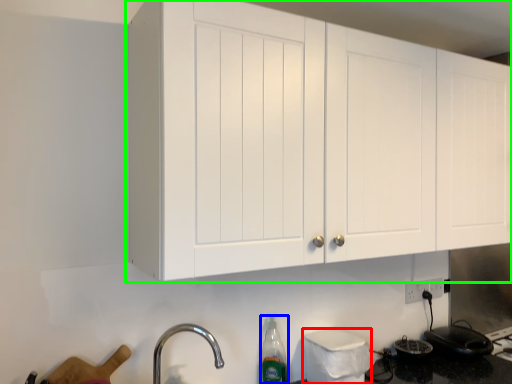
Question: Which object is the closest to the appliance (highlighted by a red box)? Choose among these: bottle (highlighted by a blue box) or cabinetry (highlighted by a green box).

Choices:
 (A) bottle
 (B) cabinetry

Answer: (A)